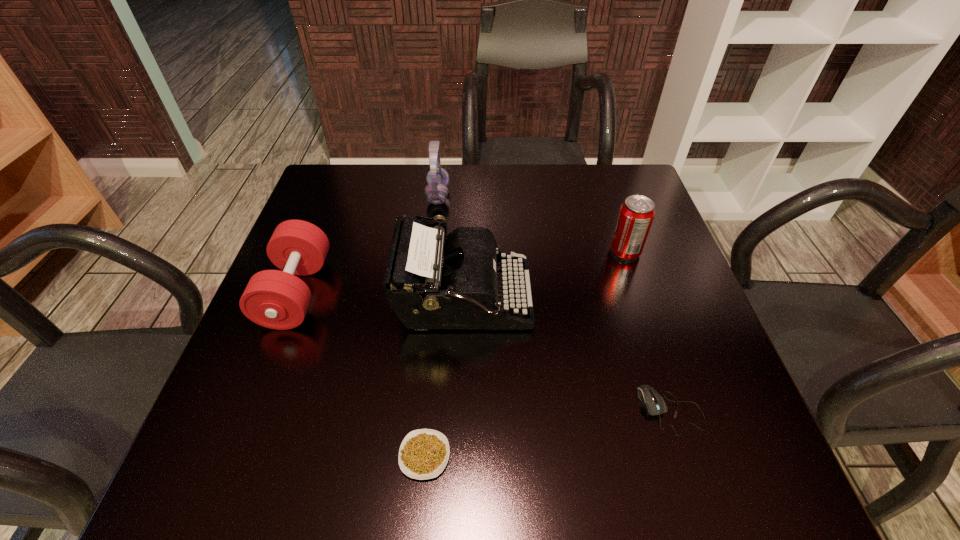
Identify the location of blank area in the image that satisfies the following two spatial constraints: 1. on the typing side of the typewriter; 2. on the back side of the computer mouse. This screenshot has height=540, width=960. (460, 410).

At what (x,y) coordinates should I click in order to perform the action: click on blank space that satisfies the following two spatial constraints: 1. on the back side of the soda; 2. on the left side of the legume. Please return your answer as a coordinate pair (x, y). This screenshot has width=960, height=540. Looking at the image, I should click on (443, 252).